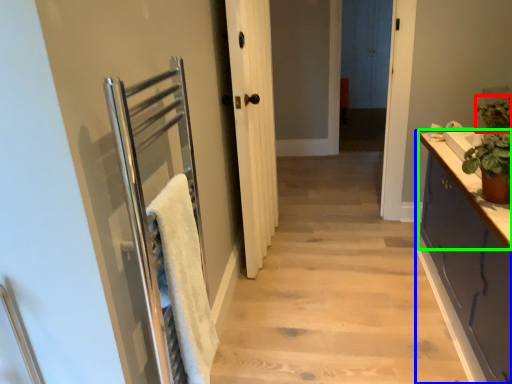
Question: Estimate the real-world distances between objects in this image. Which object is farther from plant (highlighted by a red box), cabinetry (highlighted by a blue box) or counter top (highlighted by a green box)?

Choices:
 (A) cabinetry
 (B) counter top

Answer: (A)